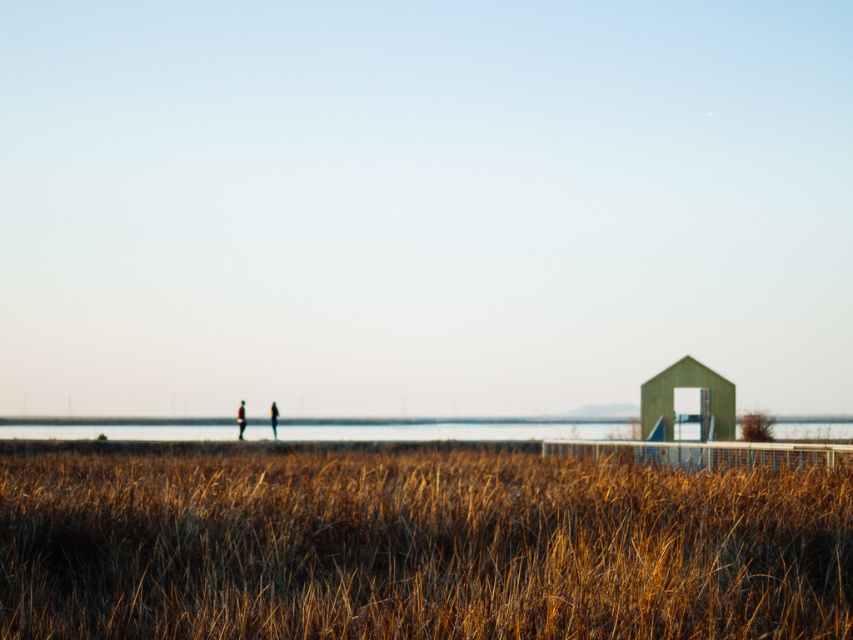
You are standing at the edge of the clear water at center and want to walk towards the matte black person at center. In which direction should you head?

The clear water at center is to the right of matte black person at center, so you should head to the left to reach them.

You are standing at the edge of the path where the two figures are walking. You want to reach the clear water at center as quickly as possible. Which direction should you walk in?

The clear water at center is located at coordinates point (456, 429), so you should walk towards the center of the image to reach it quickly.